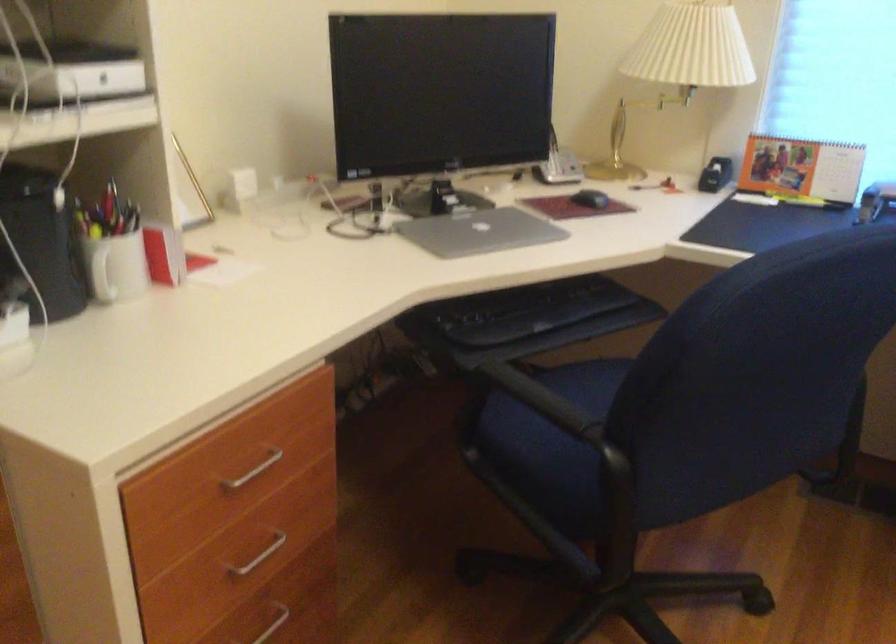
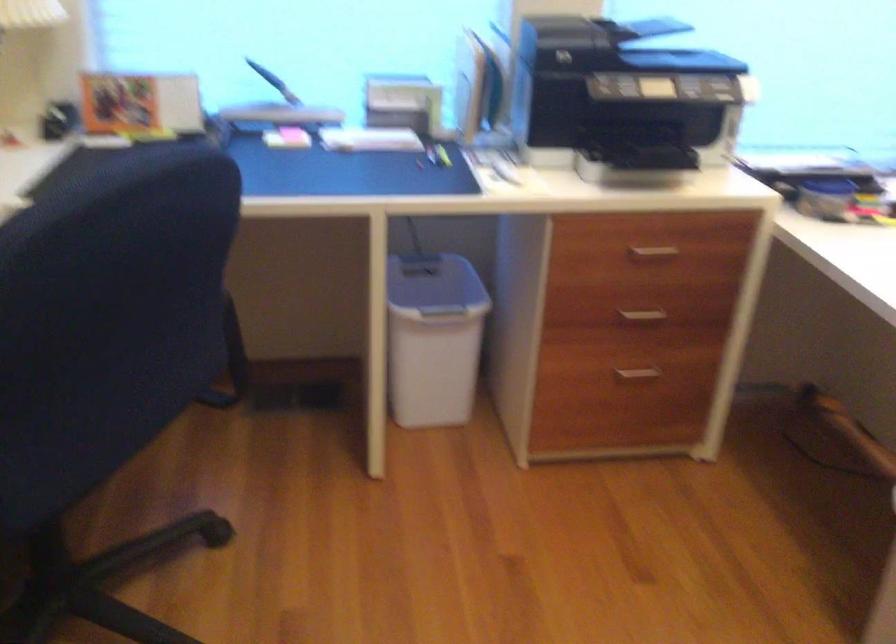
Question: The first image is from the beginning of the video and the second image is from the end. How did the camera likely rotate when shooting the video?

Choices:
 (A) Left
 (B) Right
 (C) Up
 (D) Down

Answer: (B)